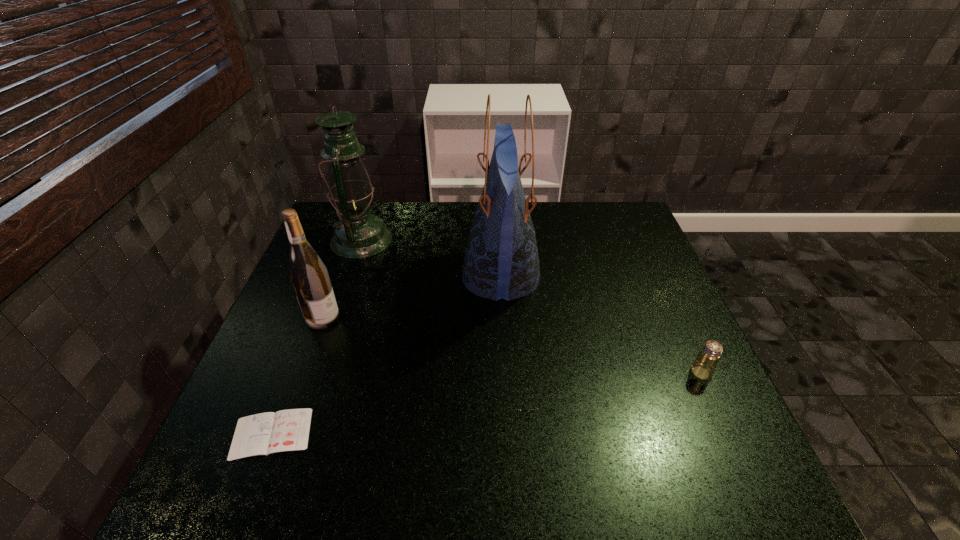
The image size is (960, 540). I want to click on empty space between the fourth object from left to right and the diary, so click(x=386, y=355).

You are a GUI agent. You are given a task and a screenshot of the screen. Output one action in this format:
    pyautogui.click(x=<x>, y=<y>)
    Task: Click on the vacant point located between the fourth shortest object and the diary
    
    Given the screenshot: What is the action you would take?
    pyautogui.click(x=317, y=337)

Identify the location of free spot between the third tallest object and the saltshaker. (512, 345).

Where is `free area in between the saltshaker and the tallest object`? This screenshot has width=960, height=540. free area in between the saltshaker and the tallest object is located at coordinates (601, 325).

This screenshot has height=540, width=960. I want to click on vacant space in between the saltshaker and the tallest object, so click(601, 325).

You are a GUI agent. You are given a task and a screenshot of the screen. Output one action in this format:
    pyautogui.click(x=<x>, y=<y>)
    Task: Click on the vacant area between the fourth shortest object and the fourth object from left to right
    The width and height of the screenshot is (960, 540).
    Given the screenshot: What is the action you would take?
    pyautogui.click(x=431, y=258)

Where is `object identified as the second closest to the tallest object`? The height and width of the screenshot is (540, 960). object identified as the second closest to the tallest object is located at coordinates (308, 274).

You are a GUI agent. You are given a task and a screenshot of the screen. Output one action in this format:
    pyautogui.click(x=<x>, y=<y>)
    Task: Click on the fourth closest object to the fourth tallest object
    
    Given the screenshot: What is the action you would take?
    pyautogui.click(x=308, y=274)

This screenshot has height=540, width=960. Find the location of `vacant space that satisfies the following two spatial constraints: 1. on the back side of the shortest object; 2. on the right side of the second tallest object`. vacant space that satisfies the following two spatial constraints: 1. on the back side of the shortest object; 2. on the right side of the second tallest object is located at coordinates (347, 240).

Locate an element on the screen. Image resolution: width=960 pixels, height=540 pixels. free location that satisfies the following two spatial constraints: 1. on the back side of the oil lamp; 2. on the left side of the shortest object is located at coordinates click(347, 240).